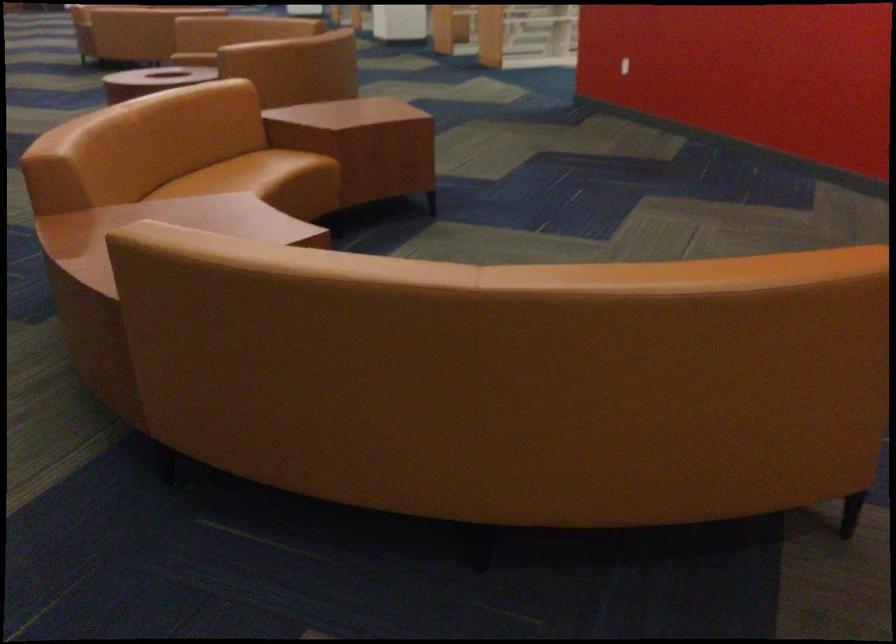
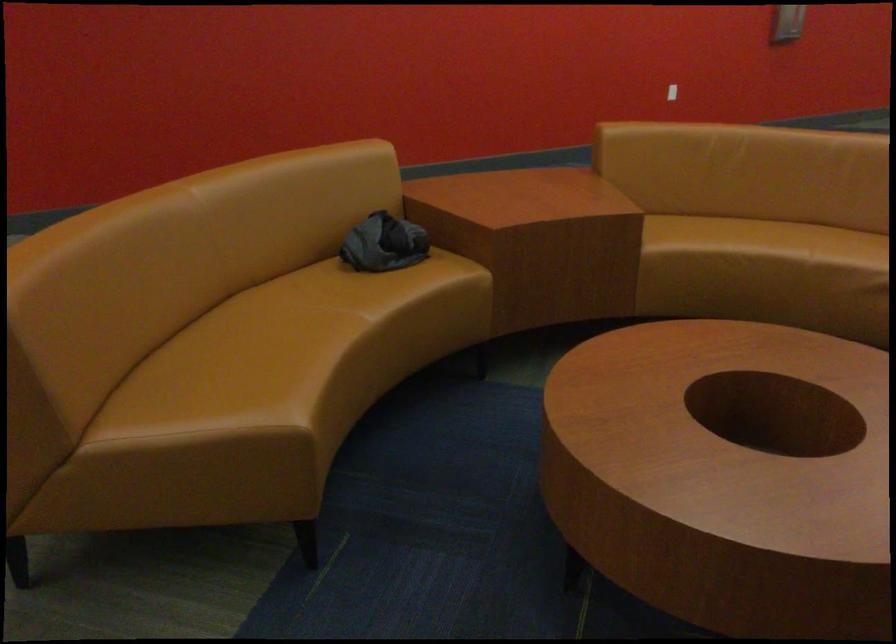
From the picture: How did the camera likely rotate?

The rotation direction of the camera is right-down.